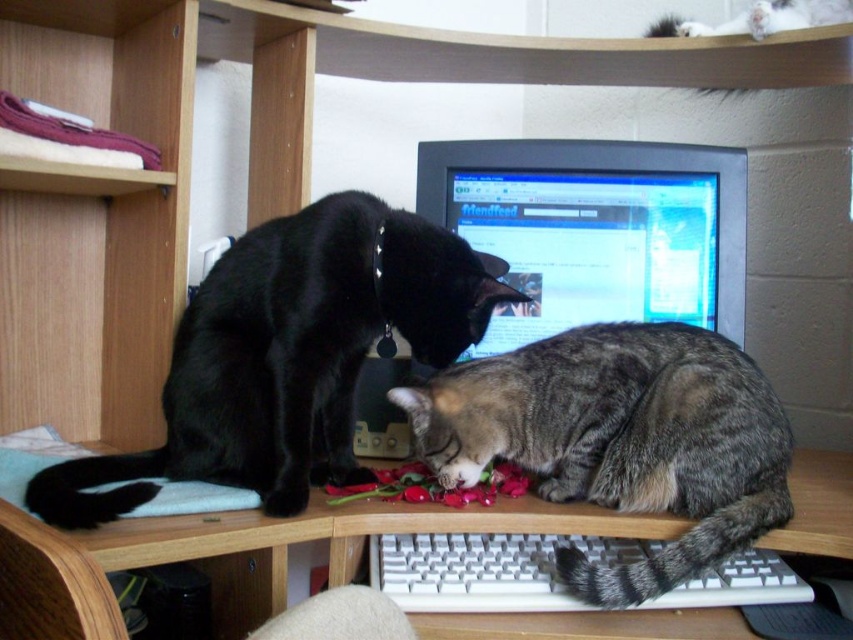
Question: Which point appears closest to the camera in this image?

Choices:
 (A) (55, 465)
 (B) (732, 602)
 (C) (16, 620)
 (D) (598, 196)

Answer: (C)

Question: Does wooden table at center have a lesser width compared to white plastic keyboard at lower center?

Choices:
 (A) no
 (B) yes

Answer: (A)

Question: Considering the relative positions of wooden table at center and white plastic keyboard at lower center in the image provided, where is wooden table at center located with respect to white plastic keyboard at lower center?

Choices:
 (A) left
 (B) right

Answer: (A)

Question: Which object appears closest to the camera in this image?

Choices:
 (A) wooden table at center
 (B) white plastic keyboard at lower center
 (C) shiny black cat at center

Answer: (A)

Question: Can you confirm if tabby fur cat at lower center is positioned to the left of wooden table at center?

Choices:
 (A) yes
 (B) no

Answer: (B)

Question: Which point is closer to the camera?

Choices:
 (A) wooden table at center
 (B) matte black monitor at center
 (C) white plastic keyboard at lower center

Answer: (A)